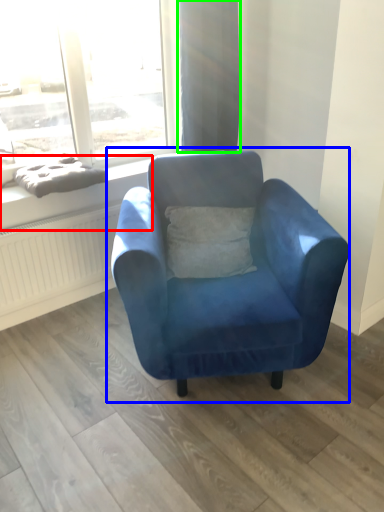
Question: Based on their relative distances, which object is nearer to window sill (highlighted by a red box)? Choose from chair (highlighted by a blue box) and curtain (highlighted by a green box).

Choices:
 (A) chair
 (B) curtain

Answer: (B)